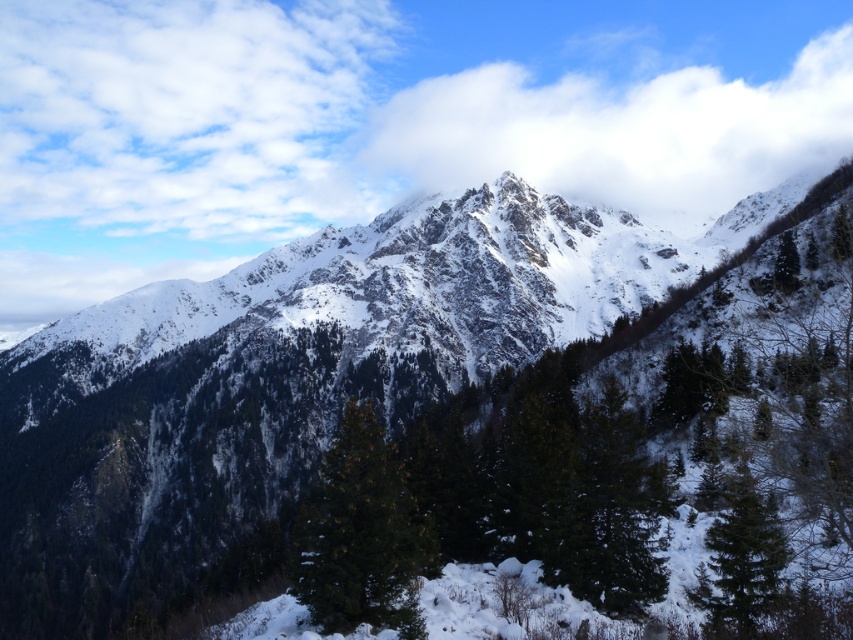
Can you confirm if green textured pine tree at center is wider than green matte tree at right?

Correct, the width of green textured pine tree at center exceeds that of green matte tree at right.

Describe the element at coordinates (363, 534) in the screenshot. I see `green textured pine tree at center` at that location.

This screenshot has height=640, width=853. Find the location of `green textured pine tree at center`. green textured pine tree at center is located at coordinates (363, 534).

Where is `green textured pine tree at center`? green textured pine tree at center is located at coordinates (363, 534).

Is green matte tree at lower right to the left of green matte tree at right from the viewer's perspective?

Yes, green matte tree at lower right is to the left of green matte tree at right.

Describe the element at coordinates (741, 556) in the screenshot. I see `green matte tree at lower right` at that location.

The image size is (853, 640). Identify the location of green matte tree at lower right. (741, 556).

Is white fluffy cloud at upper center positioned before green matte tree at right?

No, white fluffy cloud at upper center is further to the viewer.

This screenshot has height=640, width=853. Identify the location of white fluffy cloud at upper center. (622, 131).